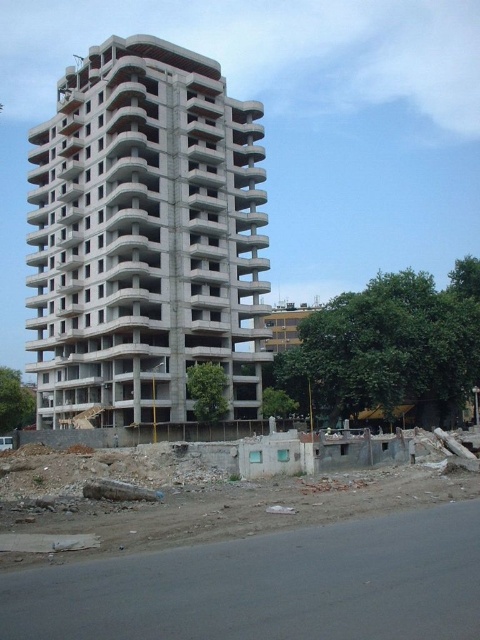
You are standing at the construction site and want to determine the relative positions of two points marked on the building. Which of the two points, point (x=95, y=474) or point (x=162, y=392), is closer to your current viewpoint?

Point (x=95, y=474) is closer to the camera than point (x=162, y=392), so it is the closer point from your viewpoint.

Consider the image. You are a construction worker standing on the dirt road near the construction site. You need to move a heavy tool from the concrete rubble at lower center to the concrete building at center. Which object is closer to your current position?

The concrete rubble at lower center is closer to the viewer than the concrete building at center, so the concrete rubble at lower center is closer to your current position.

You are standing at the construction site, and you want to reach the point marked at coordinates point (211, 636). If you can walk 2 meters per minute, how long will it take you to reach that point?

The distance between you and the point (211, 636) is 8.29 meters. At a walking speed of 2 meters per minute, it would take approximately 4.145 minutes to reach the point.